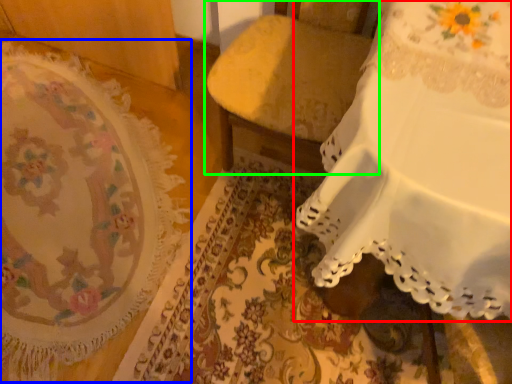
Question: Considering the real-world distances, which object is closest to furniture (highlighted by a red box)? mat (highlighted by a blue box) or furniture (highlighted by a green box).

Choices:
 (A) mat
 (B) furniture

Answer: (B)